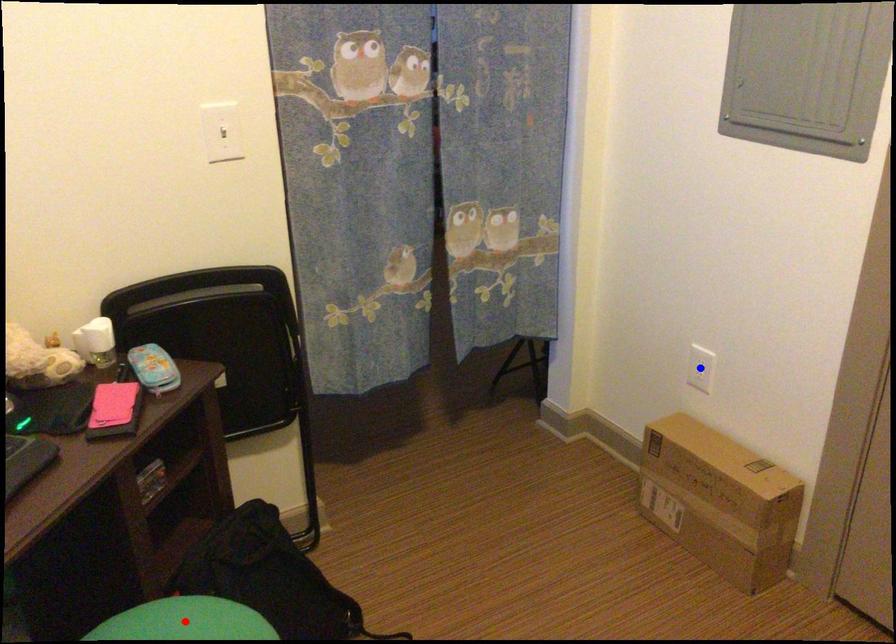
Question: In the image, two points are highlighted. Which point is nearer to the camera? Reply with the corresponding letter.

Choices:
 (A) blue point
 (B) red point

Answer: (B)